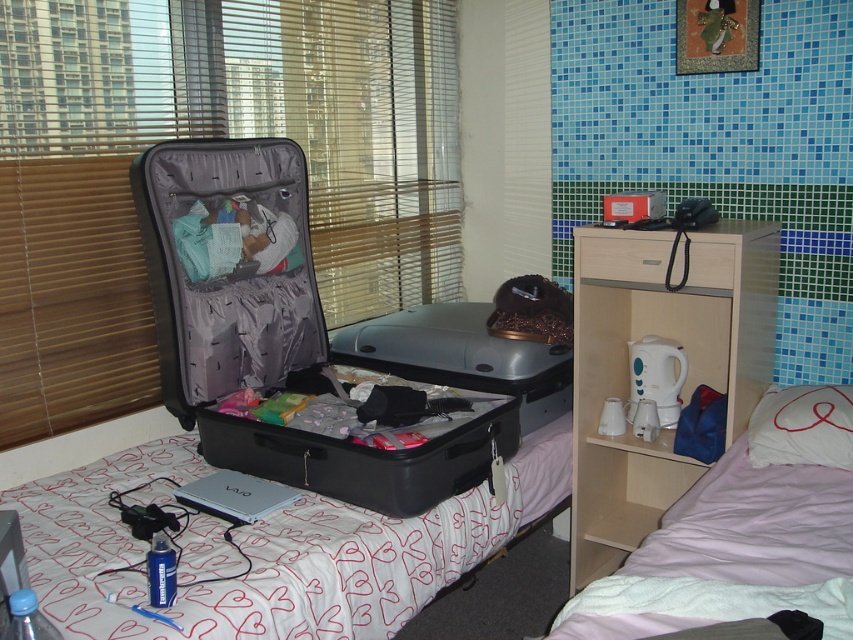
Question: Which of these objects is positioned farthest from the pink fabric bedcover at lower right?

Choices:
 (A) wooden drawer at center
 (B) matte plastic suitcase at center
 (C) matte black suitcase at center

Answer: (B)

Question: Does black matte suitcase at center lie behind pink fabric bedcover at lower right?

Choices:
 (A) yes
 (B) no

Answer: (A)

Question: Is white heart-patterned fabric at center to the left of matte black suitcase at center from the viewer's perspective?

Choices:
 (A) no
 (B) yes

Answer: (B)

Question: Based on their relative distances, which object is nearer to the matte black suitcase at center?

Choices:
 (A) black matte suitcase at center
 (B) wooden drawer at center
 (C) matte plastic suitcase at center
 (D) white heart-patterned fabric at center

Answer: (A)

Question: Can you confirm if pink fabric bedcover at lower right is bigger than matte black suitcase at center?

Choices:
 (A) yes
 (B) no

Answer: (A)

Question: Which point is closer to the camera taking this photo?

Choices:
 (A) (323, 29)
 (B) (831, 596)
 (C) (221, 429)

Answer: (B)